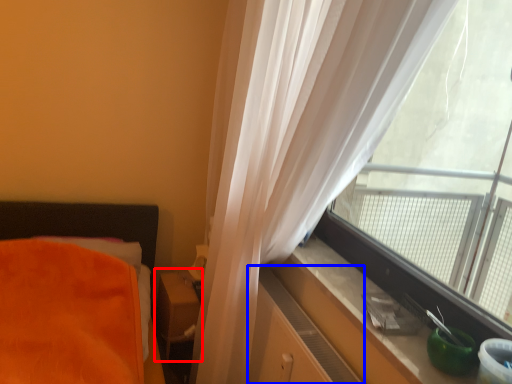
Question: Which of the following is the closest to the observer, table (highlighted by a red box) or dresser (highlighted by a blue box)?

Choices:
 (A) table
 (B) dresser

Answer: (B)